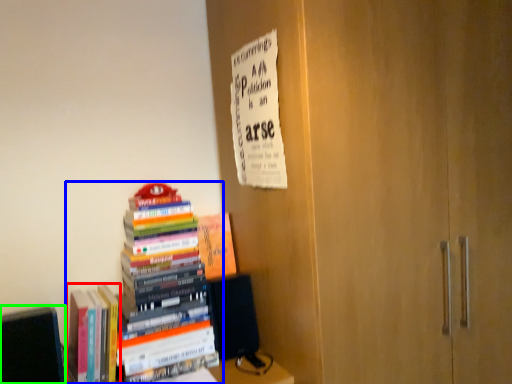
Question: Which is farther away from book (highlighted by a red box)? book (highlighted by a blue box) or book (highlighted by a green box)?

Choices:
 (A) book
 (B) book

Answer: (A)